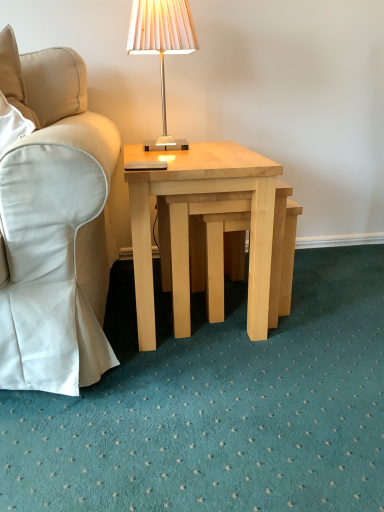
You are a GUI agent. You are given a task and a screenshot of the screen. Output one action in this format:
    pyautogui.click(x=<x>, y=<y>)
    Task: Click on the vacant region in front of light wood/natural wood coffee table at center
    The image size is (384, 512).
    Given the screenshot: What is the action you would take?
    pyautogui.click(x=207, y=394)